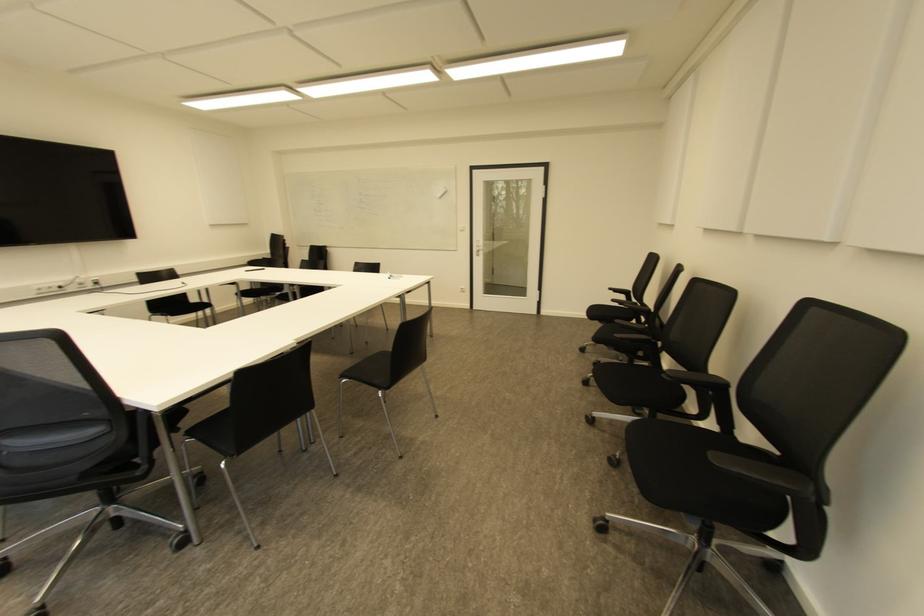
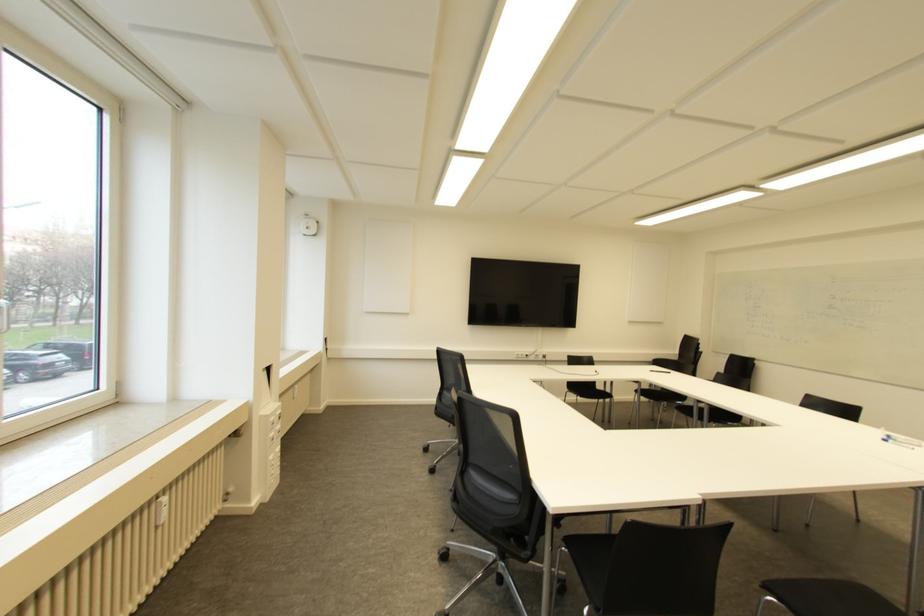
The point at (96, 282) is marked in the first image. Where is the corresponding point in the second image?

(543, 355)